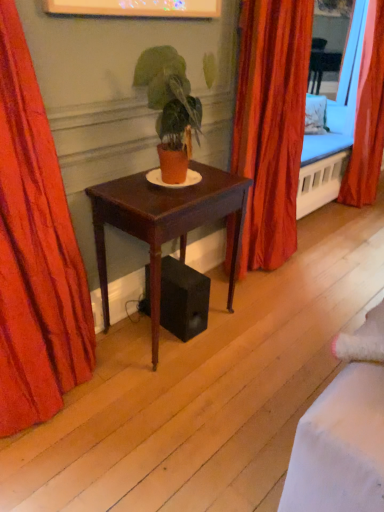
Question: Based on their sizes in the image, would you say orange fabric curtain at right, the 1th curtain positioned from the back, is bigger or smaller than velvet red curtain at left, the first curtain in the left-to-right sequence?

Choices:
 (A) small
 (B) big

Answer: (B)

Question: Is orange fabric curtain at right, arranged as the 1th curtain when viewed from the right, to the left or to the right of velvet red curtain at left, placed as the 3th curtain when sorted from right to left, in the image?

Choices:
 (A) right
 (B) left

Answer: (A)

Question: Based on their relative distances, which object is farther from the silky orange curtain at center, which appears as the 2th curtain when viewed from the left?

Choices:
 (A) orange fabric curtain at right, which ranks as the 3th curtain in front-to-back order
 (B) mahogany wood desk at center
 (C) matte orange pot at center
 (D) velvet red curtain at left, the third curtain in the back-to-front sequence

Answer: (A)

Question: Which is farther from the orange fabric curtain at right, which ranks as the 3th curtain in front-to-back order?

Choices:
 (A) mahogany wood desk at center
 (B) silky orange curtain at center, which appears as the 2th curtain when viewed from the left
 (C) matte orange pot at center
 (D) velvet red curtain at left, the third curtain in the back-to-front sequence

Answer: (D)